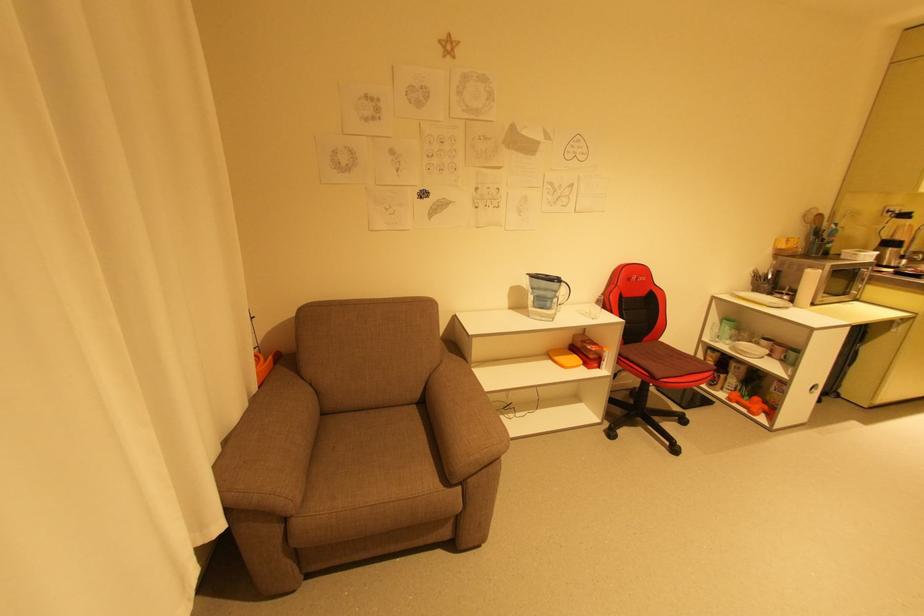
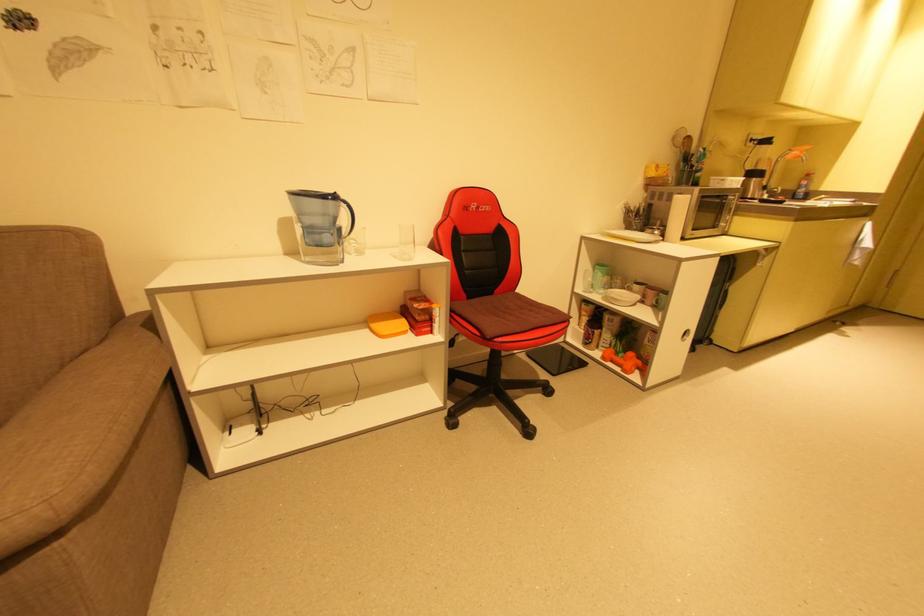
In the second image, find the point that corresponds to [590,315] in the first image.

(400, 257)